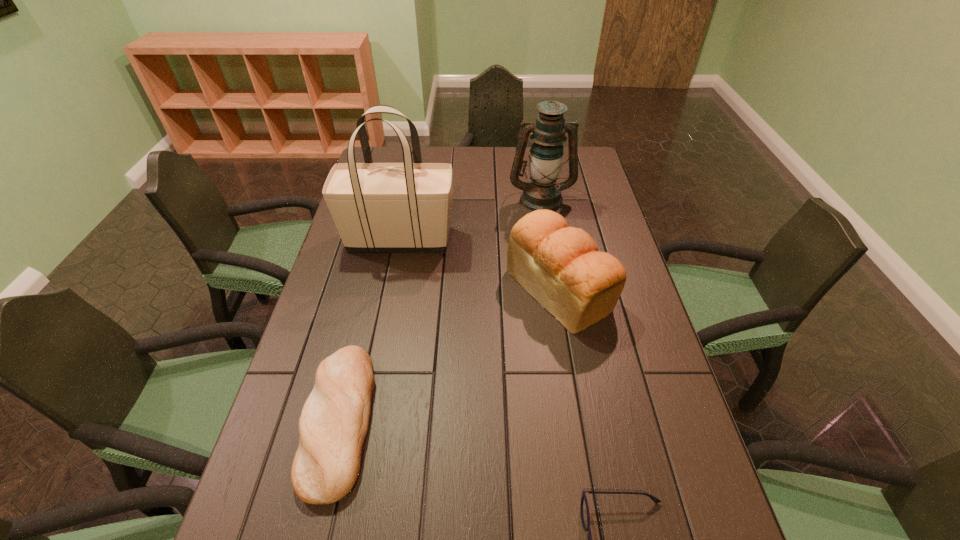
Where is `shopping bag`? The width and height of the screenshot is (960, 540). shopping bag is located at coordinates (377, 207).

Identify the location of the farthest object. The height and width of the screenshot is (540, 960). (546, 156).

The height and width of the screenshot is (540, 960). Find the location of `oil lamp`. oil lamp is located at coordinates (546, 156).

Where is `the farther bread`? the farther bread is located at coordinates (560, 266).

The height and width of the screenshot is (540, 960). What are the coordinates of `the taller bread` in the screenshot? It's located at (560, 266).

At what (x,y) coordinates should I click in order to perform the action: click on the nearer bread. Please return your answer as a coordinate pair (x, y). The image size is (960, 540). Looking at the image, I should click on (333, 425).

I want to click on the shorter bread, so click(x=333, y=425).

You are a GUI agent. You are given a task and a screenshot of the screen. Output one action in this format:
    pyautogui.click(x=<x>, y=<y>)
    Task: Click on the vacant space situated with handles facing forward on the tallest object
    This screenshot has width=960, height=540.
    Given the screenshot: What is the action you would take?
    pyautogui.click(x=559, y=239)

Identify the location of vacant area located on the front of the farthest object. (552, 264).

The width and height of the screenshot is (960, 540). I want to click on vacant space located 0.080m on the left of the farther bread, so click(x=480, y=289).